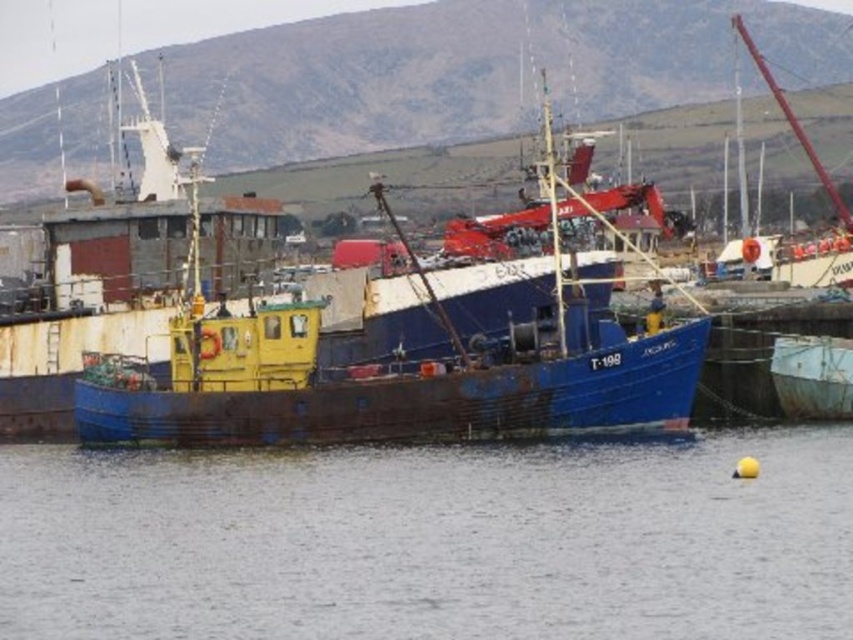
Question: Is rusty metal boat at center smaller than rusty metal boat at lower right?

Choices:
 (A) no
 (B) yes

Answer: (A)

Question: Which point is farther from the camera taking this photo?

Choices:
 (A) (724, 484)
 (B) (572, 380)

Answer: (B)

Question: Can you confirm if transparent water at center is positioned to the right of rusty metal boat at center?

Choices:
 (A) yes
 (B) no

Answer: (B)

Question: Which object is positioned closest to the transparent water at center?

Choices:
 (A) rusty metal boat at center
 (B) rusty metal boat at lower right

Answer: (A)

Question: Can you confirm if rusty metal boat at center is wider than rusty metal boat at lower right?

Choices:
 (A) yes
 (B) no

Answer: (A)

Question: Among these points, which one is nearest to the camera?

Choices:
 (A) (496, 488)
 (B) (299, 339)

Answer: (A)